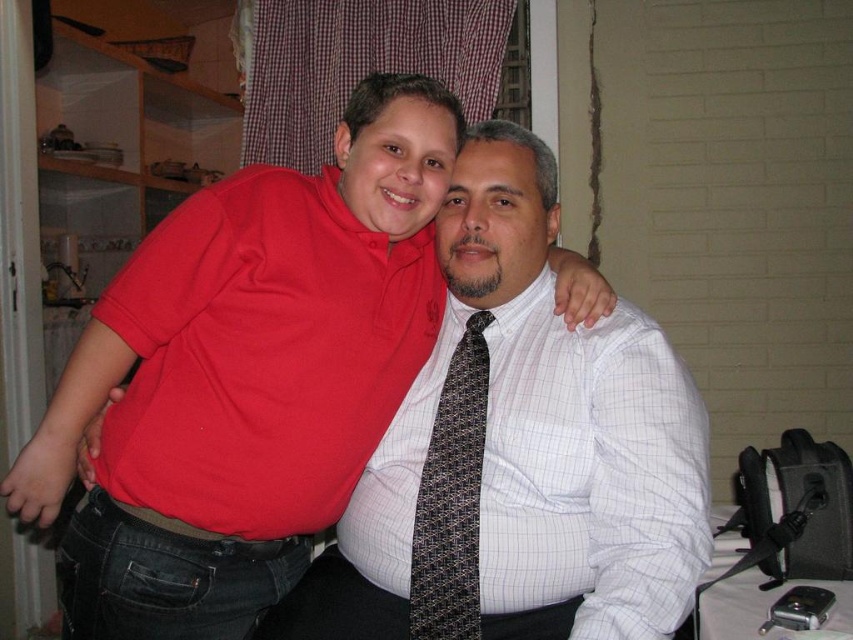
Is matte white shirt at center to the left of black textured tie at center from the viewer's perspective?

Yes, matte white shirt at center is to the left of black textured tie at center.

Can you confirm if matte white shirt at center is positioned above black textured tie at center?

Yes.

Is point (184, 554) more distant than point (421, 486)?

No, (184, 554) is closer to viewer.

Locate an element on the screen. The image size is (853, 640). matte white shirt at center is located at coordinates (247, 376).

Can you confirm if white checkered dress shirt at center is wider than black textured tie at center?

Yes.

Who is positioned more to the left, white checkered dress shirt at center or black textured tie at center?

From the viewer's perspective, black textured tie at center appears more on the left side.

Is point (656, 634) positioned after point (462, 572)?

That is False.

What are the coordinates of `white checkered dress shirt at center` in the screenshot? It's located at (590, 472).

Does matte white shirt at center appear over white checkered dress shirt at center?

Indeed, matte white shirt at center is positioned over white checkered dress shirt at center.

Does matte white shirt at center have a smaller size compared to white checkered dress shirt at center?

Incorrect, matte white shirt at center is not smaller in size than white checkered dress shirt at center.

Who is more forward, (192, 252) or (534, 570)?

Positioned in front is point (534, 570).

Where is `matte white shirt at center`? Image resolution: width=853 pixels, height=640 pixels. matte white shirt at center is located at coordinates (247, 376).